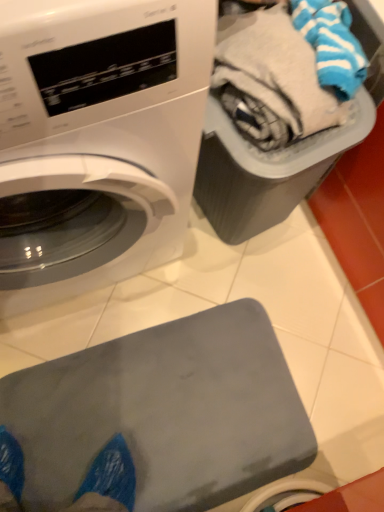
The height and width of the screenshot is (512, 384). I want to click on free space to the back side of gray rubber mat at lower center, so click(211, 286).